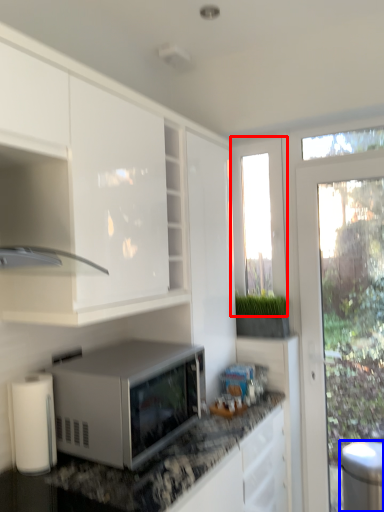
Question: Among these objects, which one is nearest to the camera, window screen (highlighted by a red box) or appliance (highlighted by a blue box)?

Choices:
 (A) window screen
 (B) appliance

Answer: (B)